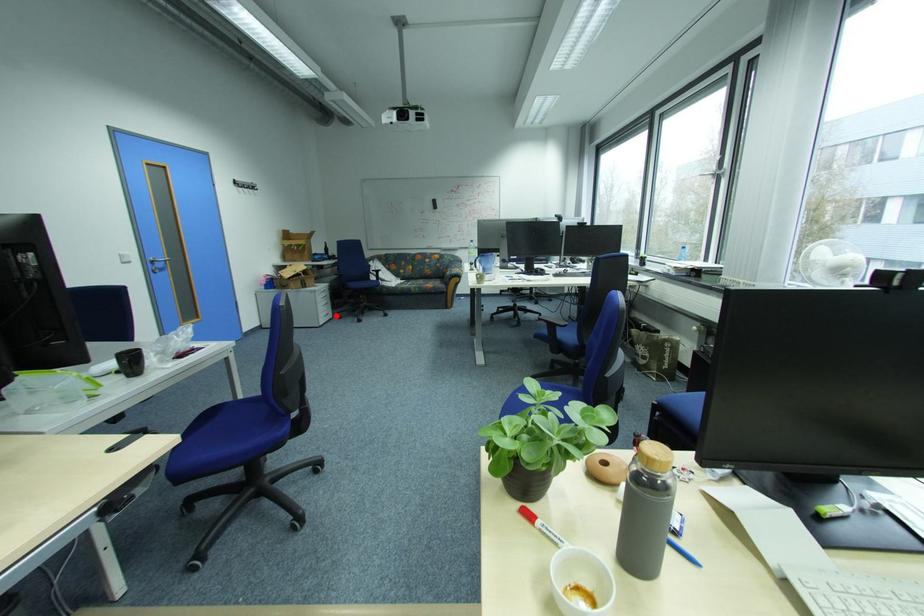
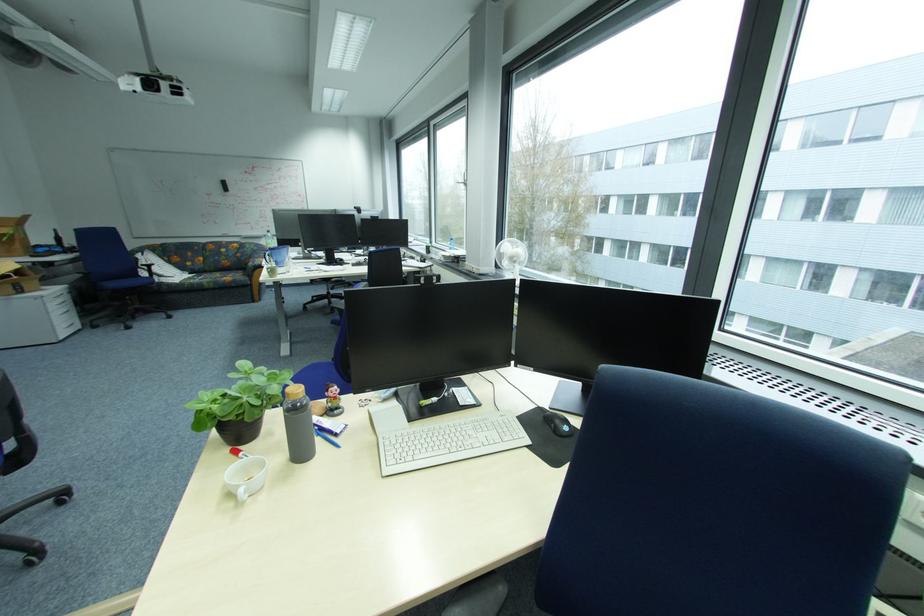
Find the pixel in the second image that matches the highlighted location in the first image.

(80, 326)